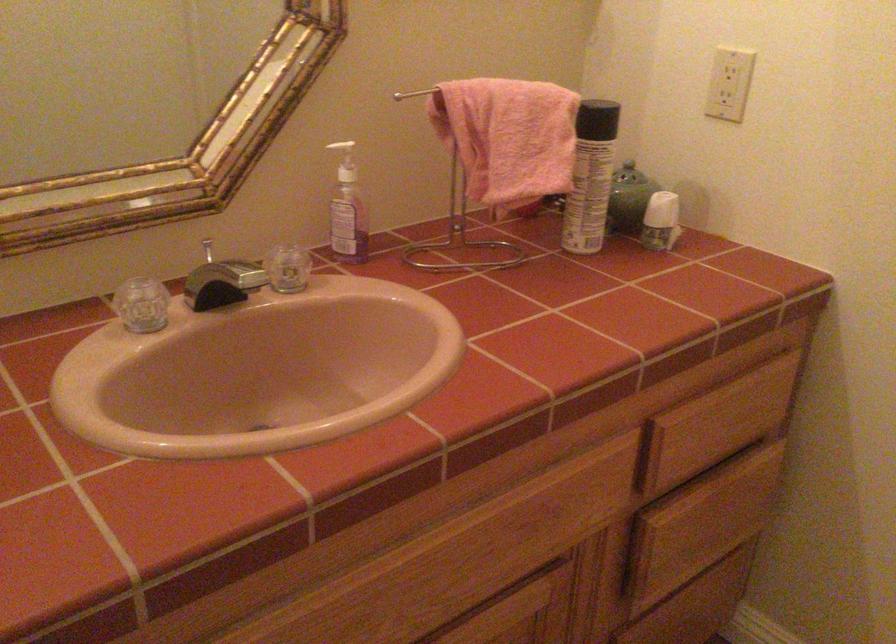
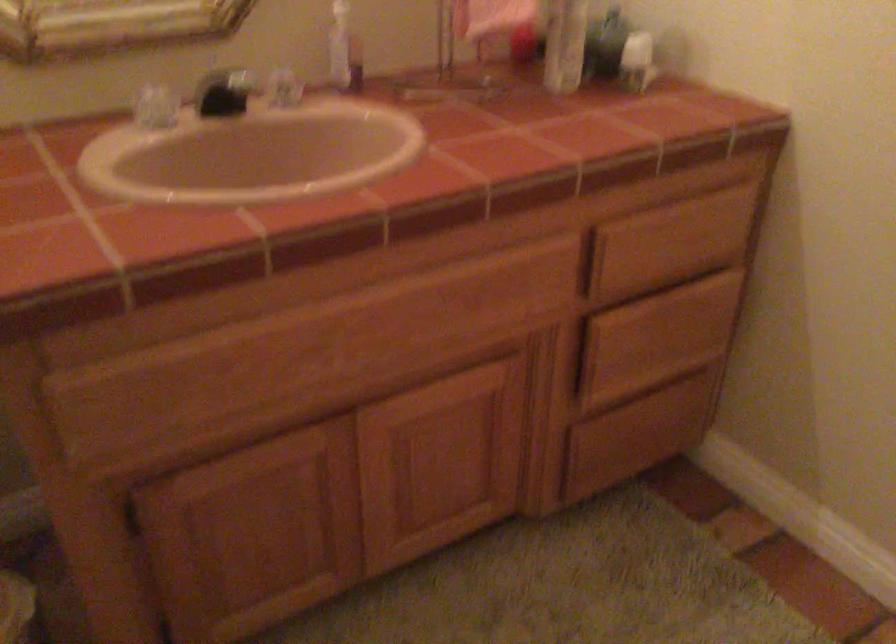
The point at (147, 313) is marked in the first image. Where is the corresponding point in the second image?

(156, 106)